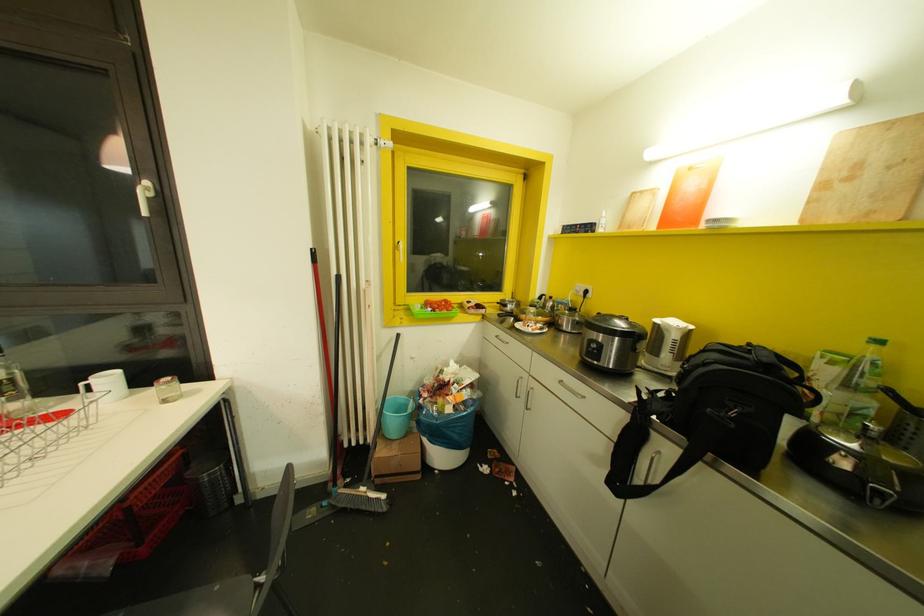
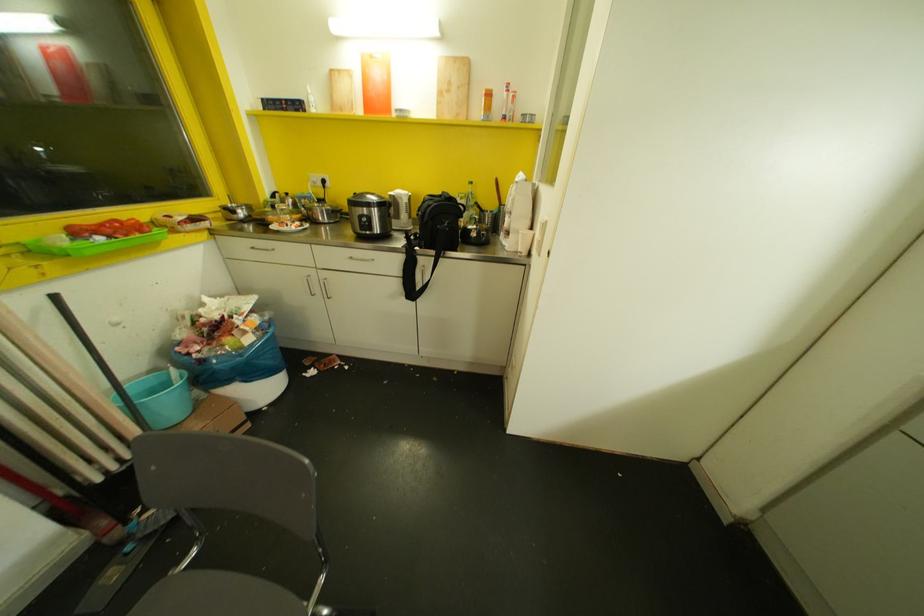
Where in the second image is the point corresponding to the point at 879,342 from the first image?

(469, 182)